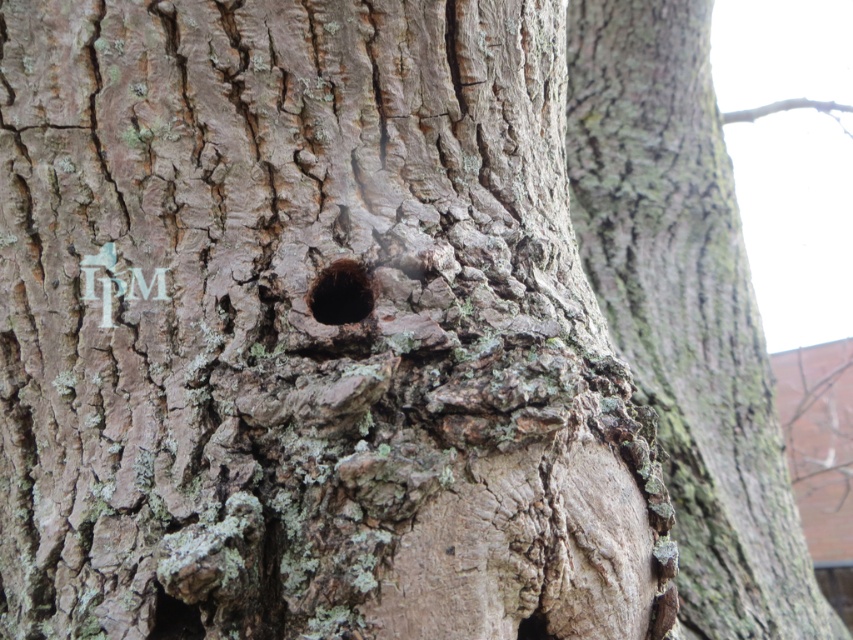
Question: Which of the following is the farthest from the observer?

Choices:
 (A) smooth gray bark at center
 (B) black rough hole at center
 (C) dark brown rough bark hole at lower left

Answer: (A)

Question: Which point appears closest to the camera in this image?

Choices:
 (A) (759, 524)
 (B) (189, 636)
 (C) (347, 268)

Answer: (B)

Question: Is the position of smooth gray bark at center less distant than that of dark brown rough bark hole at lower left?

Choices:
 (A) yes
 (B) no

Answer: (B)

Question: Is black rough hole at center wider than dark brown rough bark hole at lower left?

Choices:
 (A) no
 (B) yes

Answer: (B)

Question: Among these points, which one is farthest from the camera?

Choices:
 (A) (169, 614)
 (B) (614, 81)
 (C) (347, 300)

Answer: (B)

Question: Is smooth gray bark at center in front of dark brown rough bark hole at lower left?

Choices:
 (A) yes
 (B) no

Answer: (B)